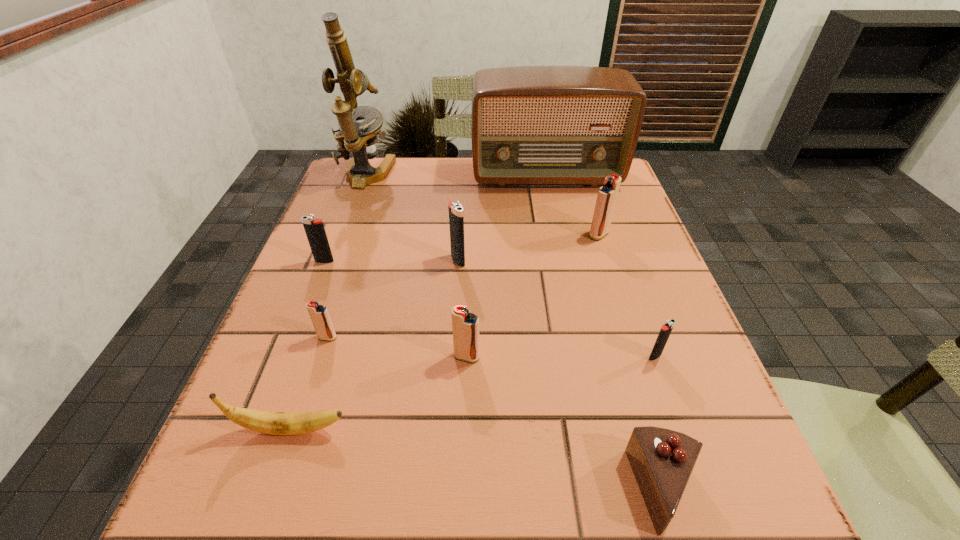
Find the location of a particular element. vacant space located 0.190m on the back of the leftmost igniter is located at coordinates (345, 210).

This screenshot has width=960, height=540. In order to click on free space located on the back of the nearest red igniter in this screenshot , I will do `click(468, 301)`.

The height and width of the screenshot is (540, 960). I want to click on vacant space situated on the peel of the yellow banana from the top, so click(592, 430).

I want to click on vacant space located on the back of the sixth farthest object, so click(369, 208).

Locate an element on the screen. free space located on the left of the rightmost black igniter is located at coordinates point(475,356).

Locate an element on the screen. The width and height of the screenshot is (960, 540). vacant space located 0.210m on the back of the nearest object is located at coordinates (620, 337).

Locate an element on the screen. This screenshot has width=960, height=540. microscope situated at the far edge is located at coordinates (359, 138).

Where is `radio receiver present at the far edge`? radio receiver present at the far edge is located at coordinates (553, 124).

I want to click on object at the near edge, so click(662, 460).

Where is `microscope that is at the left edge`? This screenshot has height=540, width=960. microscope that is at the left edge is located at coordinates (359, 138).